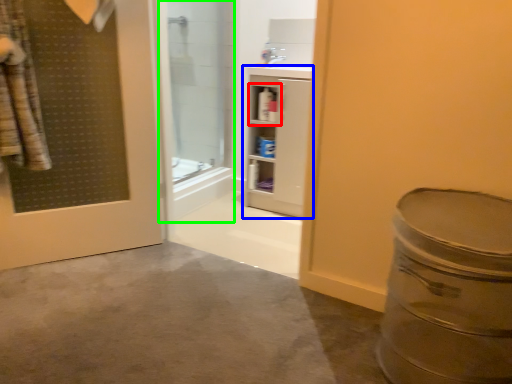
Question: Which is farther away from cabinet (highlighted by a red box)? bathroom cabinet (highlighted by a blue box) or shower door (highlighted by a green box)?

Choices:
 (A) bathroom cabinet
 (B) shower door

Answer: (B)